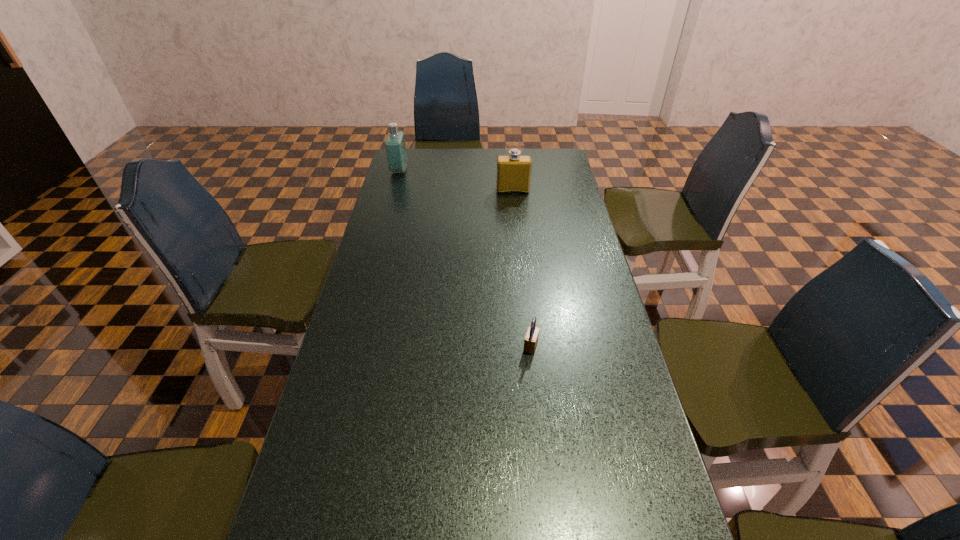
This screenshot has width=960, height=540. I want to click on blank area in the image that satisfies the following two spatial constraints: 1. on the front-facing side of the padlock; 2. on the right side of the right perfume, so click(x=529, y=346).

The width and height of the screenshot is (960, 540). In order to click on vacant space that satisfies the following two spatial constraints: 1. on the back side of the nearest object; 2. on the front label of the farther perfume in this screenshot , I will do `click(512, 171)`.

Where is `free space in the image that satisfies the following two spatial constraints: 1. on the front label of the leftmost object; 2. on the back side of the nearest object`? free space in the image that satisfies the following two spatial constraints: 1. on the front label of the leftmost object; 2. on the back side of the nearest object is located at coordinates (350, 346).

At what (x,y) coordinates should I click in order to perform the action: click on free region that satisfies the following two spatial constraints: 1. on the front-facing side of the padlock; 2. on the left side of the second nearest object. Please return your answer as a coordinate pair (x, y). This screenshot has width=960, height=540. Looking at the image, I should click on (529, 346).

The height and width of the screenshot is (540, 960). Identify the location of free spot that satisfies the following two spatial constraints: 1. on the front-facing side of the nearest object; 2. on the right side of the second farthest object. (529, 346).

Identify the location of blank area in the image that satisfies the following two spatial constraints: 1. on the front-facing side of the nearer perfume; 2. on the right side of the padlock. The width and height of the screenshot is (960, 540). (529, 346).